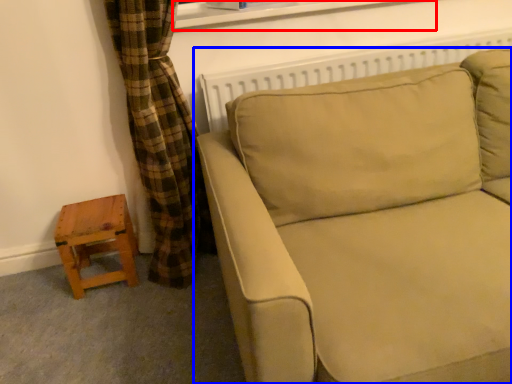
Question: Which object appears farthest to the camera in this image, window frame (highlighted by a red box) or studio couch (highlighted by a blue box)?

Choices:
 (A) window frame
 (B) studio couch

Answer: (A)